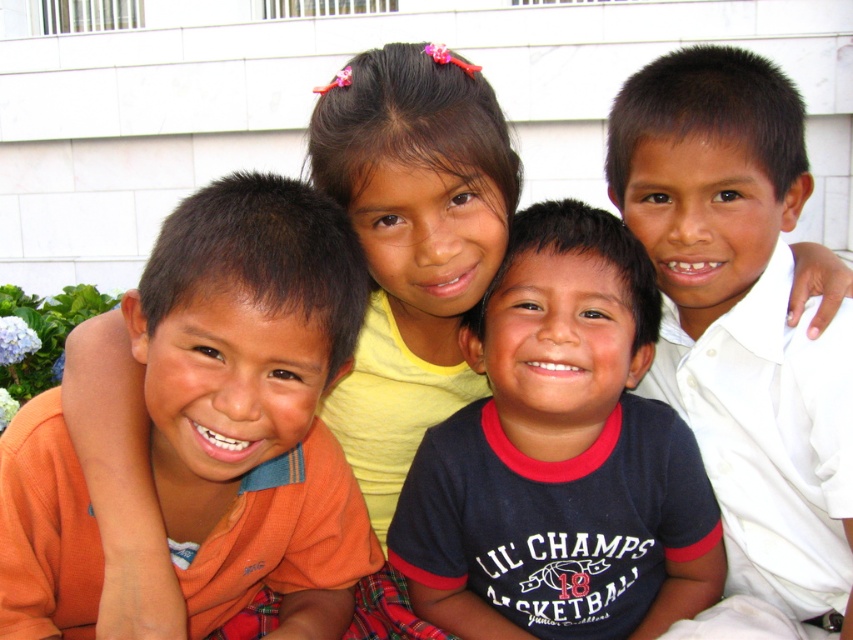
You are a photographer setting up for a group photo. You need to ensure the dark blue jersey at center and the white smooth shirt at right are visible. Considering their sizes, which one might require more space in the frame to avoid being cropped?

The dark blue jersey at center requires more space in the frame because its width is larger than the white smooth shirt at right, so it needs to be positioned to avoid being cropped.

You are a photographer adjusting your camera to focus on the orange cotton shirt at left and the dark blue jersey at center. Which child should you focus on first to ensure both are in sharp focus?

You should focus on the orange cotton shirt at left first because it is closer to the viewer than the dark blue jersey at center, so starting with the closer object ensures proper focus for both.